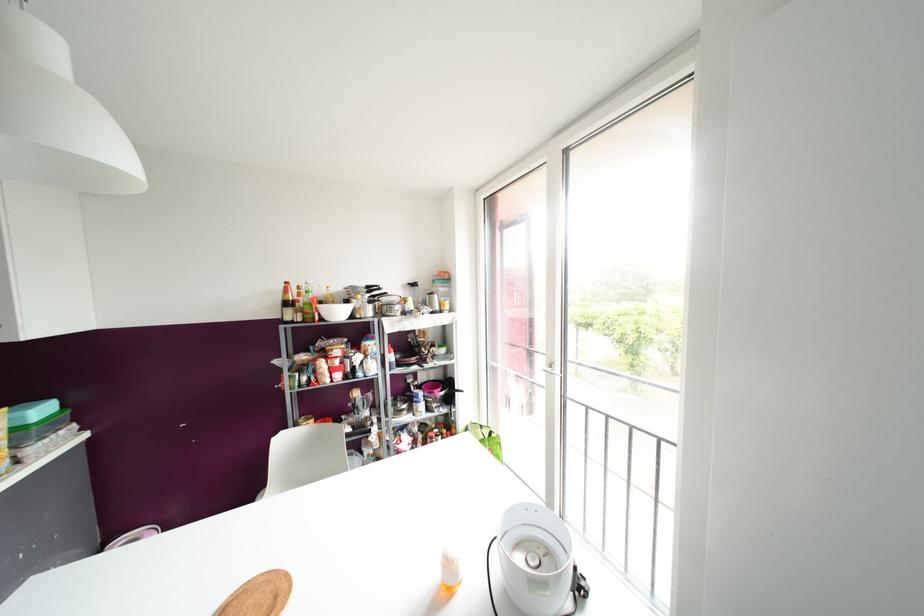
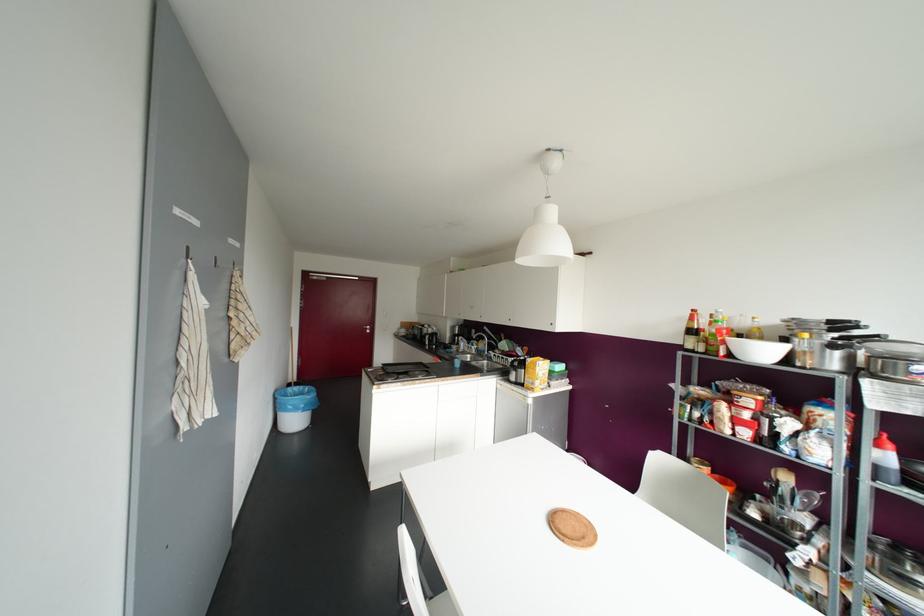
Question: The camera is either moving clockwise (left) or counter-clockwise (right) around the object. The first image is from the beginning of the video and the second image is from the end. Is the camera moving left or right when shooting the video?

Choices:
 (A) Left
 (B) Right

Answer: (B)